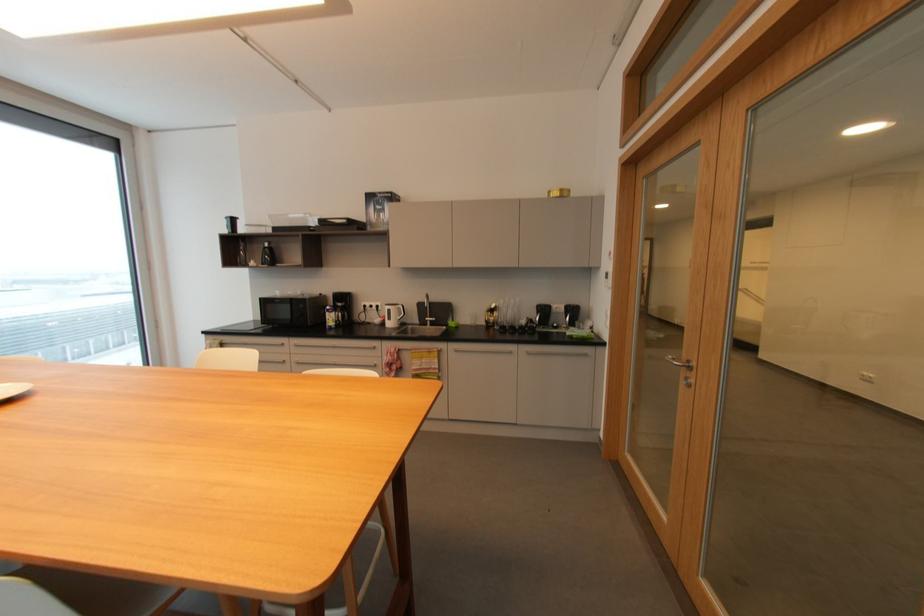
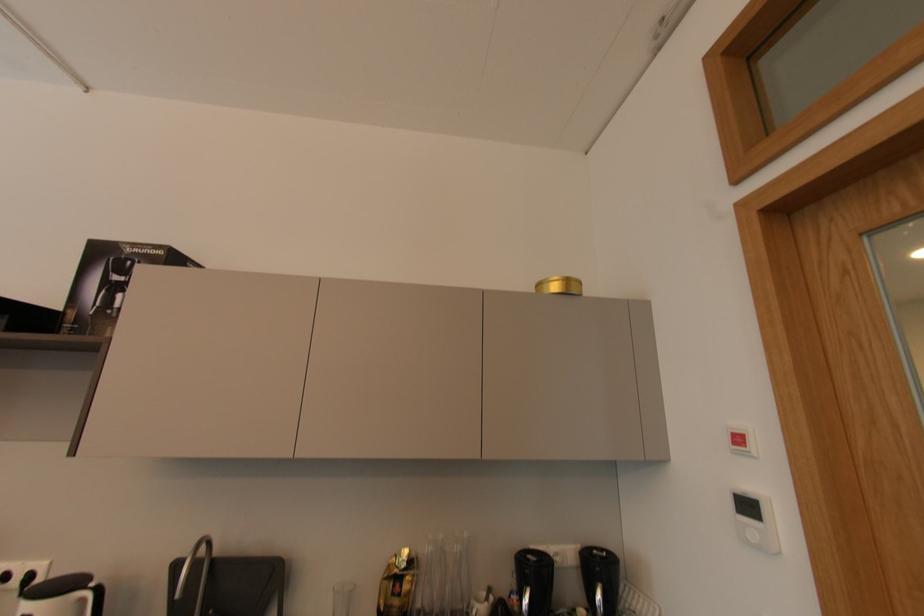
Question: Which direction would the cameraman need to move to produce the second image? Reply with the corresponding letter.

Choices:
 (A) Left
 (B) Right
 (C) Forward
 (D) Backward

Answer: (C)